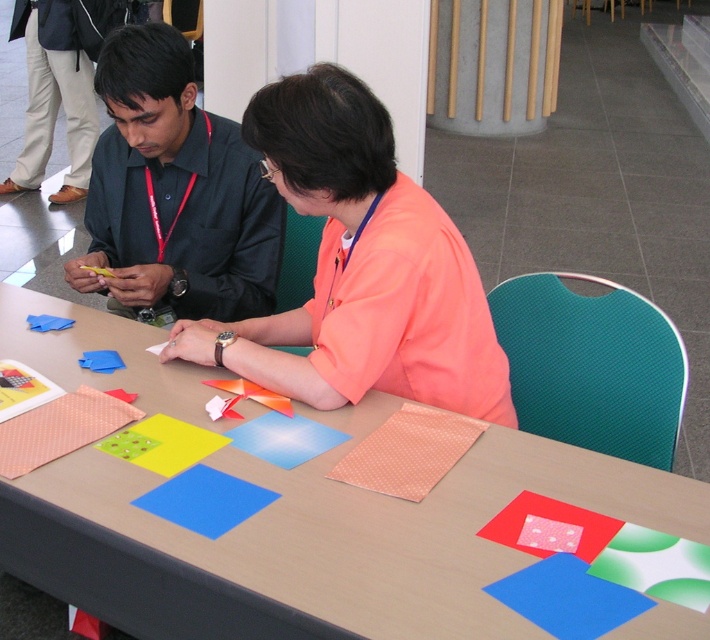
You are a delivery robot with a 12 inch wide package. You need to place it on the smooth wooden table at center without moving the orange matte shirt at center. Is there enough space between them?

The distance between the smooth wooden table at center and the orange matte shirt at center is 11.77 inches. Since the package is 12 inches wide, it is slightly wider than the available space, so the robot cannot place the package without moving the orange matte shirt at center.

You are standing at the edge of the table in the image. There is a point labeled at coordinates (360, 268). What object is located at that point?

The point at coordinates (360, 268) indicates the orange matte shirt at center.

You are trying to place a large decorative item on the smooth wooden table at center. Considering the matte black shirt at left is currently occupying space on the table, can you estimate if there is enough space left on the table to accommodate the item?

The smooth wooden table at center might be wider than matte black shirt at left, so there could be sufficient space remaining on the table to place the decorative item.